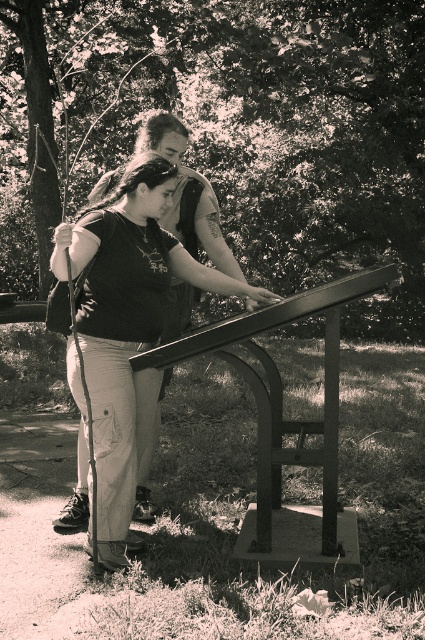
Looking at this image, is matte black shirt at center taller than metallic/smooth rail at center?

Yes, matte black shirt at center is taller than metallic/smooth rail at center.

Can you confirm if matte black shirt at center is bigger than metallic/smooth rail at center?

Incorrect, matte black shirt at center is not larger than metallic/smooth rail at center.

Is point (118, 428) positioned before point (152, 356)?

No, it is behind (152, 356).

Where is `matte black shirt at center`? This screenshot has width=425, height=640. matte black shirt at center is located at coordinates (127, 324).